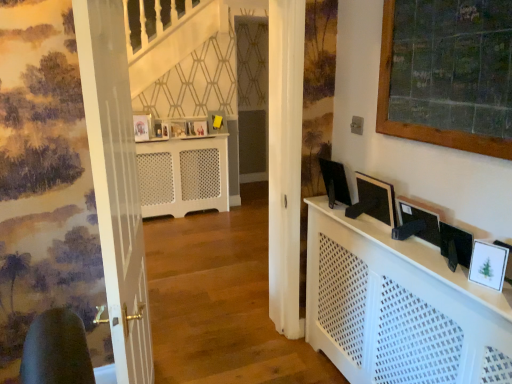
Identify the location of empty space that is ontop of white perforated cabinet at center (from a real-world perspective). (406, 240).